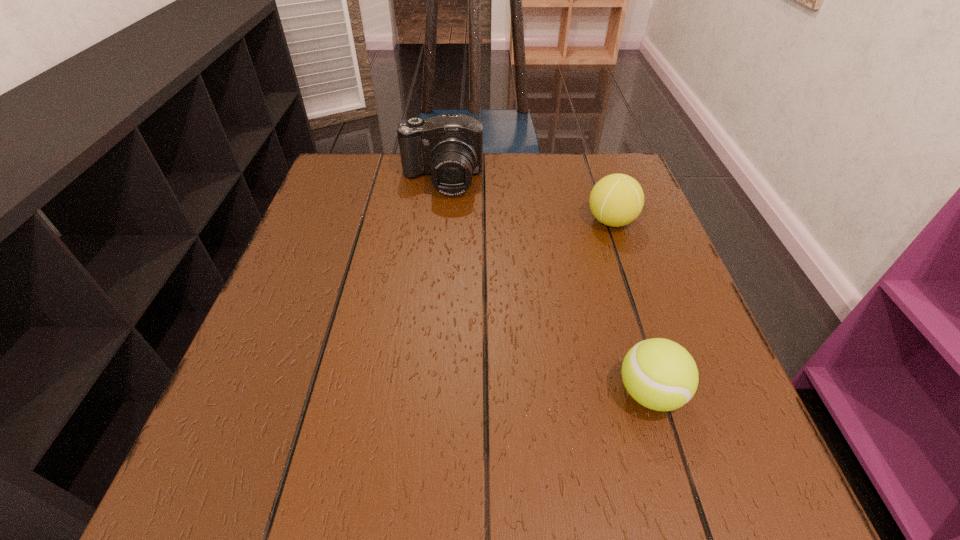
Image resolution: width=960 pixels, height=540 pixels. Find the location of `the farthest object`. the farthest object is located at coordinates (449, 147).

Locate an element on the screen. Image resolution: width=960 pixels, height=540 pixels. the leftmost object is located at coordinates (449, 147).

Locate an element on the screen. the second farthest object is located at coordinates (616, 200).

The height and width of the screenshot is (540, 960). I want to click on the nearer tennis ball, so click(x=660, y=374).

Find the location of `free region located on the lens of the farthest object`. free region located on the lens of the farthest object is located at coordinates (437, 220).

At what (x,y) coordinates should I click in order to perform the action: click on free space located 0.310m on the left of the second farthest object. Please return your answer as a coordinate pair (x, y). Looking at the image, I should click on (450, 221).

This screenshot has height=540, width=960. Find the location of `free point located on the left of the nearer tennis ball`. free point located on the left of the nearer tennis ball is located at coordinates pyautogui.click(x=400, y=393).

The height and width of the screenshot is (540, 960). What are the coordinates of `object located at the far edge` in the screenshot? It's located at (449, 147).

Locate an element on the screen. The width and height of the screenshot is (960, 540). free point at the far edge is located at coordinates (496, 188).

Find the location of a particular element. This screenshot has width=960, height=540. vacant space at the left edge of the desktop is located at coordinates (323, 226).